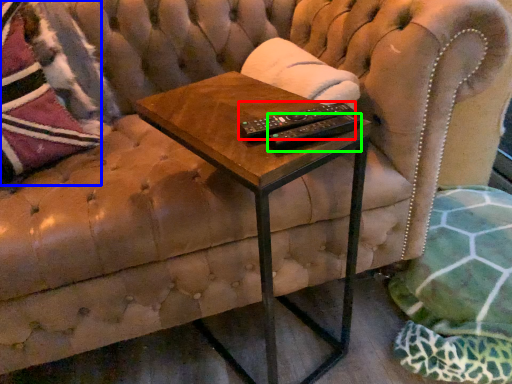
Question: Based on their relative distances, which object is farther from control (highlighted by a red box)? Choose from throw pillow (highlighted by a blue box) and remote (highlighted by a green box).

Choices:
 (A) throw pillow
 (B) remote

Answer: (A)